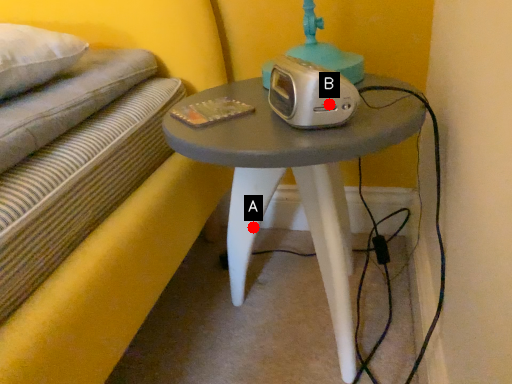
Question: Two points are circled on the image, labeled by A and B beside each circle. Which of the following is the farthest from the observer?

Choices:
 (A) A is further
 (B) B is further

Answer: (A)